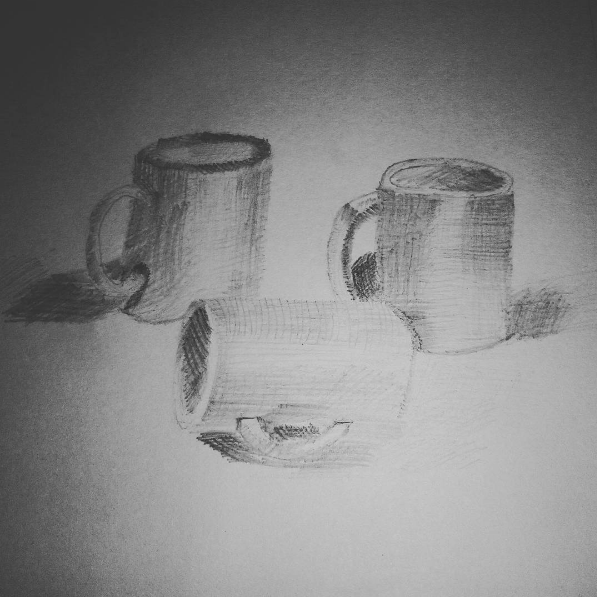
This screenshot has width=597, height=597. I want to click on drawings of mugs, so click(301, 369), click(201, 227), click(439, 246).